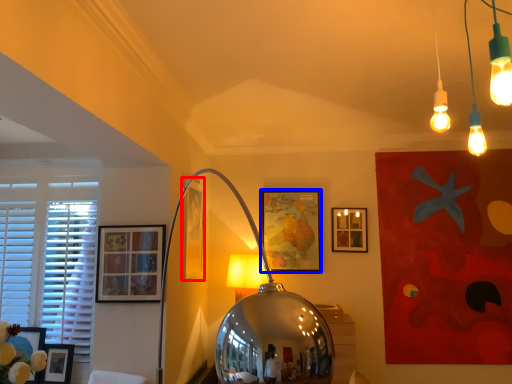
Question: Which point is closer to the camera, picture frame (highlighted by a red box) or picture frame (highlighted by a blue box)?

Choices:
 (A) picture frame
 (B) picture frame

Answer: (A)